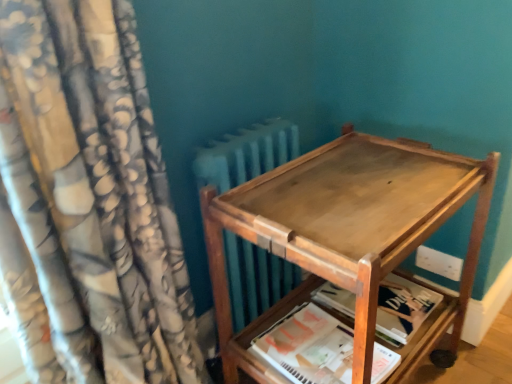
Question: Considering the relative positions of wooden paperback book at lower right, which is the second paperback book in front-to-back order, and wooden tray at center in the image provided, is wooden paperback book at lower right, which is the second paperback book in front-to-back order, to the right of wooden tray at center from the viewer's perspective?

Choices:
 (A) no
 (B) yes

Answer: (B)

Question: From a real-world perspective, is wooden paperback book at lower right, which is the second paperback book in front-to-back order, under wooden tray at center?

Choices:
 (A) yes
 (B) no

Answer: (A)

Question: From a real-world perspective, does wooden paperback book at lower right, which is the second paperback book in front-to-back order, stand above wooden tray at center?

Choices:
 (A) no
 (B) yes

Answer: (A)

Question: Is wooden paperback book at lower right, which is the second paperback book in front-to-back order, shorter than wooden tray at center?

Choices:
 (A) yes
 (B) no

Answer: (A)

Question: Could wooden tray at center be considered to be inside wooden paperback book at lower right, the first paperback book viewed from the back?

Choices:
 (A) no
 (B) yes

Answer: (A)

Question: Considering the relative positions of wooden paperback book at lower right, the first paperback book viewed from the back, and wooden tray at center in the image provided, is wooden paperback book at lower right, the first paperback book viewed from the back, in front of wooden tray at center?

Choices:
 (A) yes
 (B) no

Answer: (B)

Question: Is wooden paperback book at lower right, the first paperback book viewed from the back, looking in the opposite direction of floral fabric curtain at left?

Choices:
 (A) no
 (B) yes

Answer: (A)

Question: Considering the relative sizes of wooden paperback book at lower right, the first paperback book viewed from the back, and floral fabric curtain at left in the image provided, is wooden paperback book at lower right, the first paperback book viewed from the back, shorter than floral fabric curtain at left?

Choices:
 (A) yes
 (B) no

Answer: (A)

Question: From a real-world perspective, is wooden paperback book at lower right, which is the second paperback book in front-to-back order, beneath floral fabric curtain at left?

Choices:
 (A) no
 (B) yes

Answer: (B)

Question: Does wooden paperback book at lower right, which is the second paperback book in front-to-back order, come in front of floral fabric curtain at left?

Choices:
 (A) no
 (B) yes

Answer: (A)

Question: Would you say wooden paperback book at lower right, the first paperback book viewed from the back, is outside floral fabric curtain at left?

Choices:
 (A) yes
 (B) no

Answer: (A)

Question: Are wooden paperback book at lower right, which is the second paperback book in front-to-back order, and floral fabric curtain at left located far from each other?

Choices:
 (A) yes
 (B) no

Answer: (B)

Question: Is white paper at lower center, marked as the 1th paperback book in a front-to-back arrangement, facing towards wooden paperback book at lower right, the first paperback book viewed from the back?

Choices:
 (A) no
 (B) yes

Answer: (A)